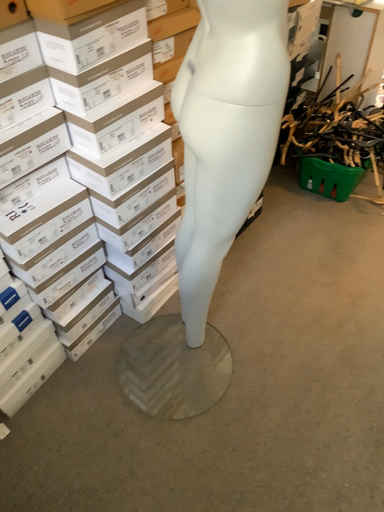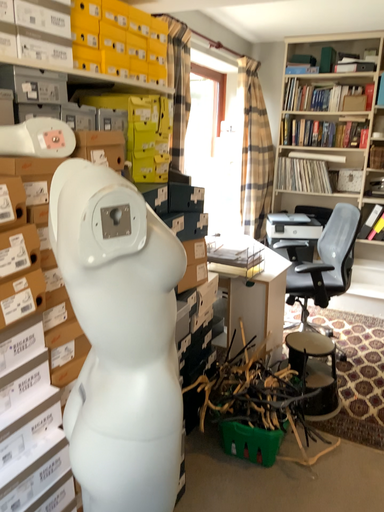
Question: How did the camera likely rotate when shooting the video?

Choices:
 (A) rotated downward
 (B) rotated upward

Answer: (B)